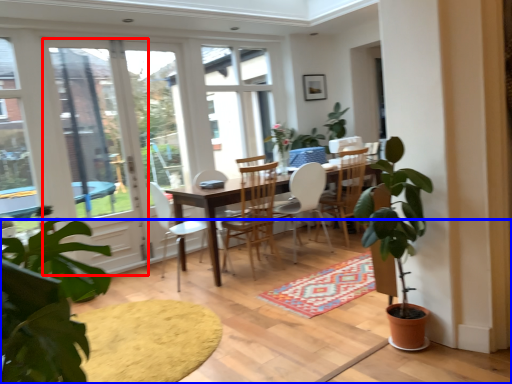
Question: Which object appears closest to the camera in this image, screen door (highlighted by a red box) or carpeting (highlighted by a blue box)?

Choices:
 (A) screen door
 (B) carpeting

Answer: (B)